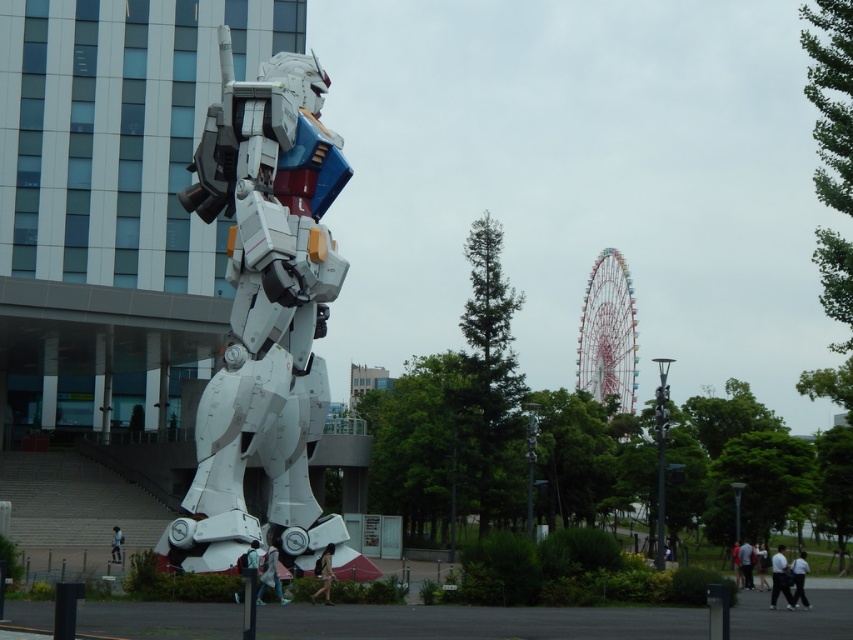
Who is more forward, (776, 576) or (762, 564)?

Point (776, 576) is more forward.

Does white cotton shirt at center have a lesser height compared to white matte shirt at lower right?

No, white cotton shirt at center is not shorter than white matte shirt at lower right.

Between point (776, 568) and point (764, 550), which one is positioned behind?

Positioned behind is point (764, 550).

Locate an element on the screen. The image size is (853, 640). white cotton shirt at center is located at coordinates (780, 579).

Is point (268, 572) less distant than point (743, 556)?

Yes, it is in front of point (743, 556).

You are a GUI agent. You are given a task and a screenshot of the screen. Output one action in this format:
    pyautogui.click(x=<x>, y=<y>)
    Task: Click on the light blue fabric backpack at lower center
    The image size is (853, 640).
    Given the screenshot: What is the action you would take?
    pyautogui.click(x=270, y=573)

Between white metallic robot at center and light blue fabric jacket at center, which one is positioned higher?

white metallic robot at center is above.

The width and height of the screenshot is (853, 640). Find the location of `white metallic robot at center`. white metallic robot at center is located at coordinates (264, 310).